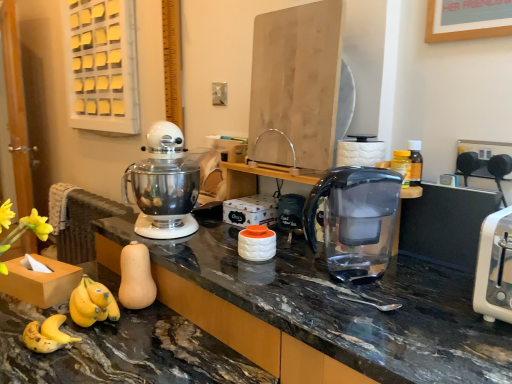
Question: Considering their positions, is transparent plastic water filter pitcher at center located in front of or behind white plastic toaster at right?

Choices:
 (A) behind
 (B) front

Answer: (A)

Question: Considering the positions of transparent plastic water filter pitcher at center and white plastic toaster at right in the image, is transparent plastic water filter pitcher at center wider or thinner than white plastic toaster at right?

Choices:
 (A) wide
 (B) thin

Answer: (B)

Question: Estimate the real-world distances between objects in this image. Which object is farther from the marble black countertop at lower left?

Choices:
 (A) matte black jar at center
 (B) satin silver mixer at center
 (C) transparent plastic water filter pitcher at center
 (D) white plastic toaster at right

Answer: (A)

Question: Which of these objects is positioned farthest from the transparent plastic water filter pitcher at center?

Choices:
 (A) matte black jar at center
 (B) satin silver mixer at center
 (C) white plastic toaster at right
 (D) marble black countertop at lower left

Answer: (B)